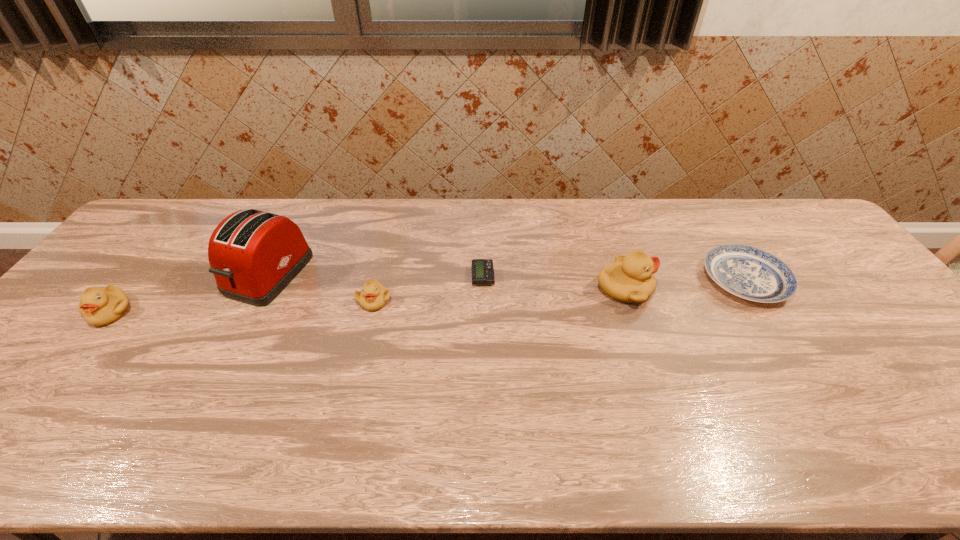
Where is `the second shortest object`? the second shortest object is located at coordinates (747, 272).

Locate an element on the screen. The image size is (960, 540). the rightmost object is located at coordinates (747, 272).

Find the location of a particular element. This screenshot has width=960, height=540. vacant region located 0.080m at the beak of the leftmost object is located at coordinates (78, 354).

Image resolution: width=960 pixels, height=540 pixels. I want to click on vacant region located at the beak of the fourth object from right to left, so click(359, 366).

The height and width of the screenshot is (540, 960). What are the coordinates of `vacant area situated 0.250m at the beak of the second object from right to left` in the screenshot? It's located at (741, 289).

Locate an element on the screen. The height and width of the screenshot is (540, 960). free space located on the right of the shortest object is located at coordinates (539, 276).

This screenshot has height=540, width=960. I want to click on vacant space situated on the front of the toaster, so click(x=213, y=387).

Find the location of a particular element. The height and width of the screenshot is (540, 960). vacant space located 0.250m on the left of the rightmost object is located at coordinates (617, 280).

Where is `object present at the left edge`? The image size is (960, 540). object present at the left edge is located at coordinates (99, 307).

This screenshot has height=540, width=960. I want to click on vacant region at the far edge of the desktop, so click(345, 232).